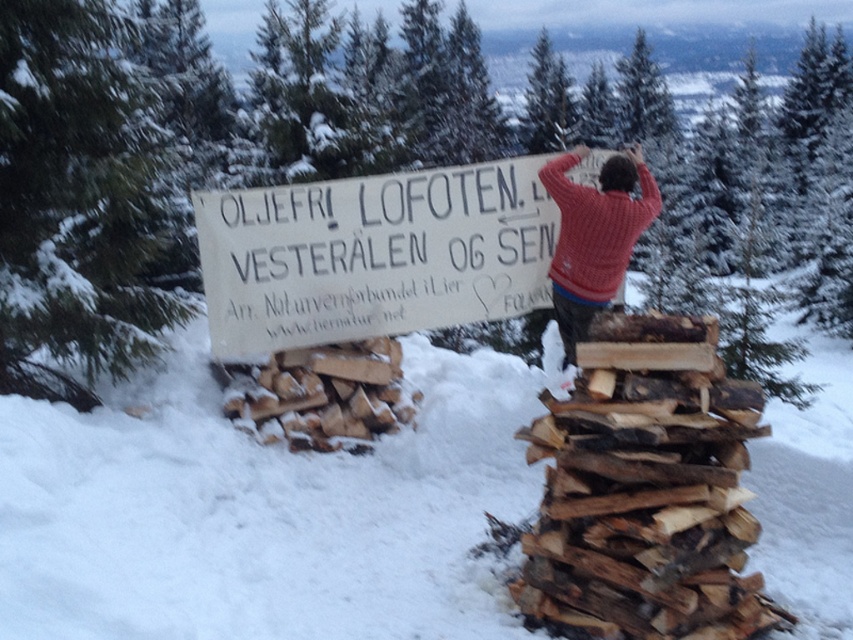
Consider the image. Based on the scene description, which object is wider? The green textured pine at upper left or the knitted wool sweater at upper right?

The green textured pine at upper left is wider than the knitted wool sweater at upper right according to the description.

You are a photographer trying to capture the signboard and the person in the image. The camera you are using has a limited field of view. Given that the white powdery snow at center is located at point [262,513], which object should you focus on first to ensure both the signboard and the person are in the frame?

The white powdery snow at center is located at point [262,513], so you should focus on the signboard first because it is closer to the snow at center compared to the person who is behind it.